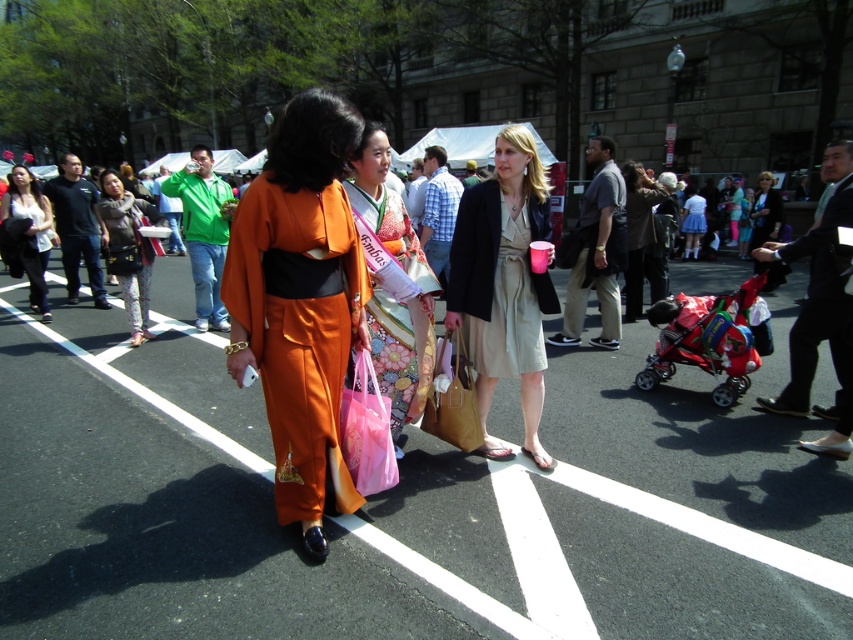
Question: Which of the following is the farthest from the observer?

Choices:
 (A) (756, 273)
 (B) (630, 189)
 (C) (405, 404)
 (D) (744, 314)

Answer: (A)

Question: Can you confirm if orange silk kimono at center is thinner than white satin dress at center?

Choices:
 (A) no
 (B) yes

Answer: (B)

Question: Considering the relative positions of orange silk kimono at center and matte black jacket at right in the image provided, where is orange silk kimono at center located with respect to matte black jacket at right?

Choices:
 (A) below
 (B) above

Answer: (A)

Question: Which point appears closest to the camera in this image?

Choices:
 (A) (695, 228)
 (B) (544, 186)

Answer: (B)

Question: Does matte black purse at center have a greater width compared to brown leather jacket at center?

Choices:
 (A) yes
 (B) no

Answer: (B)

Question: Estimate the real-world distances between objects in this image. Which object is closer to the matte black purse at center?

Choices:
 (A) brown leather jacket at center
 (B) silky orange kimono at center
 (C) orange silk kimono at center

Answer: (B)